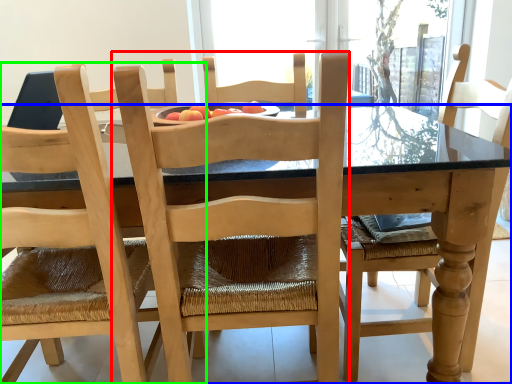
Question: Based on their relative distances, which object is farther from chair (highlighted by a red box)? Choose from kitchen & dining room table (highlighted by a blue box) and chair (highlighted by a green box).

Choices:
 (A) kitchen & dining room table
 (B) chair

Answer: (A)